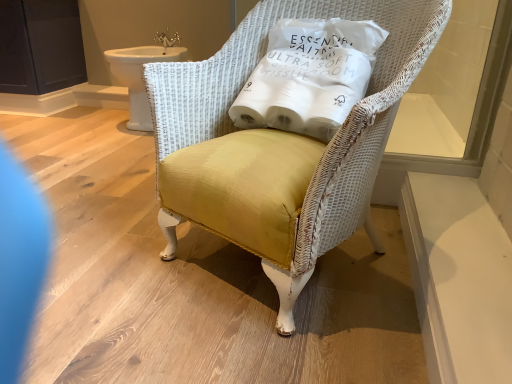
Where is `free space to the left of white wicker chair at center`? The width and height of the screenshot is (512, 384). free space to the left of white wicker chair at center is located at coordinates (100, 255).